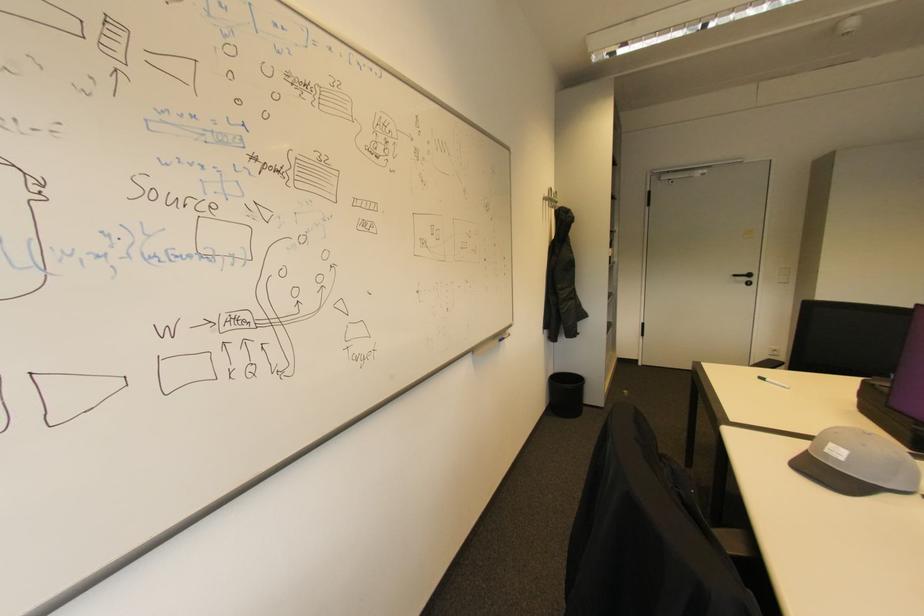
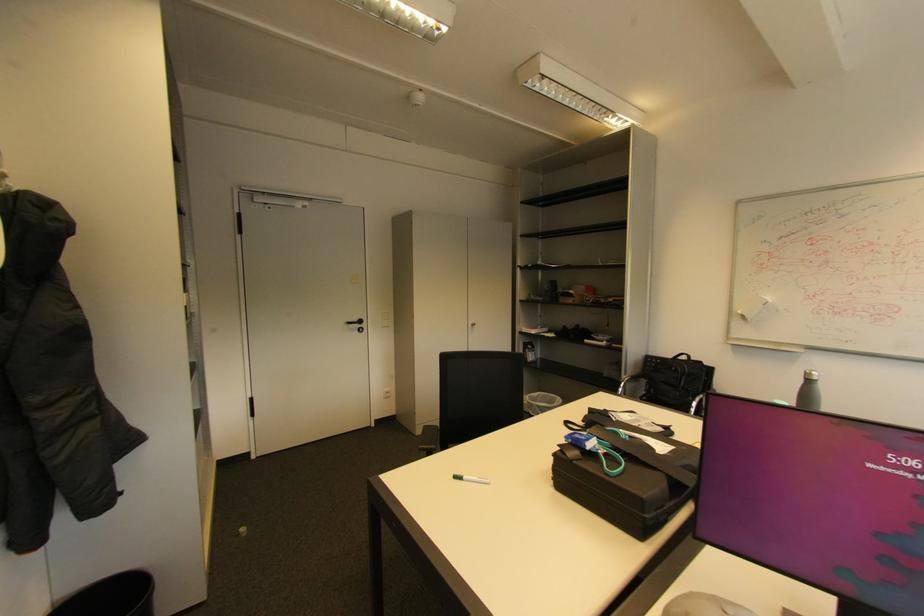
Locate, in the second image, the point that corresponds to point (587, 385) in the first image.

(150, 599)